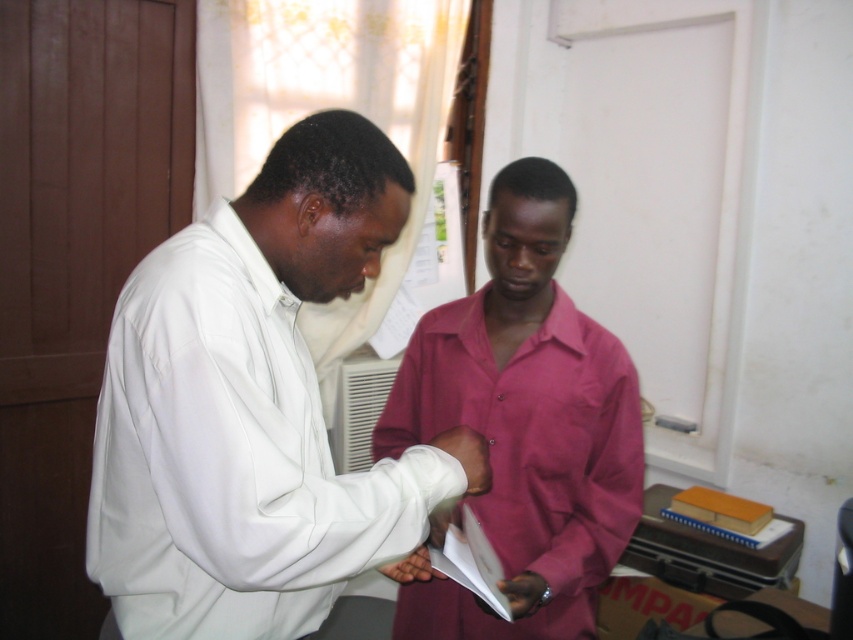
You are an observer in the room. You notice the matte pink shirt at center and the white paper at center. Which object is nearer to you?

The matte pink shirt at center is closer to the viewer than the white paper at center.

You are standing in the room and want to hand a document to the person wearing the white smooth shirt at center. Based on their position in the image, which direction should you walk to approach them?

The white smooth shirt at center is located at coordinates 0.637 on the x axis and 0.299 on the y axis. To approach them, you should move towards the lower right direction since the shirt is positioned at that coordinate in the image.